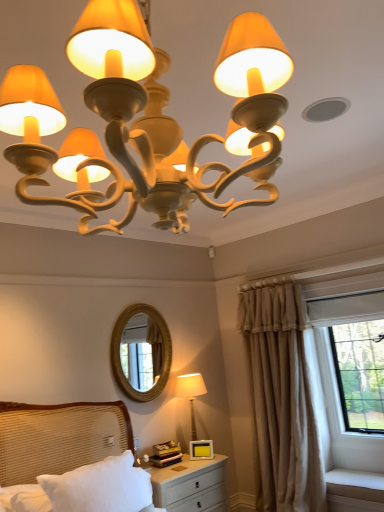
Question: From a real-world perspective, is white textured bed at lower left over gold textured mirror at center?

Choices:
 (A) no
 (B) yes

Answer: (A)

Question: Can you confirm if white textured bed at lower left is wider than gold textured mirror at center?

Choices:
 (A) no
 (B) yes

Answer: (B)

Question: Is white textured bed at lower left placed right next to gold textured mirror at center?

Choices:
 (A) no
 (B) yes

Answer: (A)

Question: Is white textured bed at lower left smaller than gold textured mirror at center?

Choices:
 (A) no
 (B) yes

Answer: (A)

Question: Does white textured bed at lower left have a larger size compared to gold textured mirror at center?

Choices:
 (A) no
 (B) yes

Answer: (B)

Question: Looking at the image, does white textured bed at lower left seem bigger or smaller compared to matte cream chandelier at upper center, the first lamp positioned from the front?

Choices:
 (A) big
 (B) small

Answer: (B)

Question: Is white textured bed at lower left taller or shorter than matte cream chandelier at upper center, the 2th lamp from the back?

Choices:
 (A) short
 (B) tall

Answer: (A)

Question: From the image's perspective, is white textured bed at lower left positioned above or below matte cream chandelier at upper center, the first lamp positioned from the front?

Choices:
 (A) below
 (B) above

Answer: (A)

Question: Do you think white textured bed at lower left is within matte cream chandelier at upper center, the 2th lamp from the back, or outside of it?

Choices:
 (A) inside
 (B) outside

Answer: (B)

Question: From a real-world perspective, is matte cream lamp at lower center, which appears as the 1th lamp when ordered from the bottom, above or below white textured bed at lower left?

Choices:
 (A) below
 (B) above

Answer: (B)

Question: Is matte cream lamp at lower center, placed as the 1th lamp when sorted from back to front, wider or thinner than white textured bed at lower left?

Choices:
 (A) wide
 (B) thin

Answer: (A)

Question: Considering the positions of matte cream lamp at lower center, placed as the 2th lamp when sorted from top to bottom, and white textured bed at lower left in the image, is matte cream lamp at lower center, placed as the 2th lamp when sorted from top to bottom, bigger or smaller than white textured bed at lower left?

Choices:
 (A) small
 (B) big

Answer: (A)

Question: Considering the relative positions of matte cream lamp at lower center, placed as the 2th lamp when sorted from top to bottom, and white textured bed at lower left in the image provided, is matte cream lamp at lower center, placed as the 2th lamp when sorted from top to bottom, to the left or to the right of white textured bed at lower left?

Choices:
 (A) left
 (B) right

Answer: (B)

Question: In terms of size, does gold textured mirror at center appear bigger or smaller than matte cream lamp at lower center, the 2th lamp positioned from the front?

Choices:
 (A) small
 (B) big

Answer: (A)

Question: Is gold textured mirror at center in front of or behind matte cream lamp at lower center, the 2th lamp positioned from the front, in the image?

Choices:
 (A) behind
 (B) front

Answer: (B)